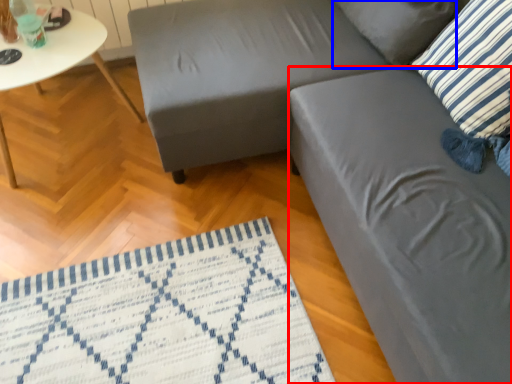
Question: Among these objects, which one is nearest to the camera, swivel chair (highlighted by a red box) or pillow (highlighted by a blue box)?

Choices:
 (A) swivel chair
 (B) pillow

Answer: (A)